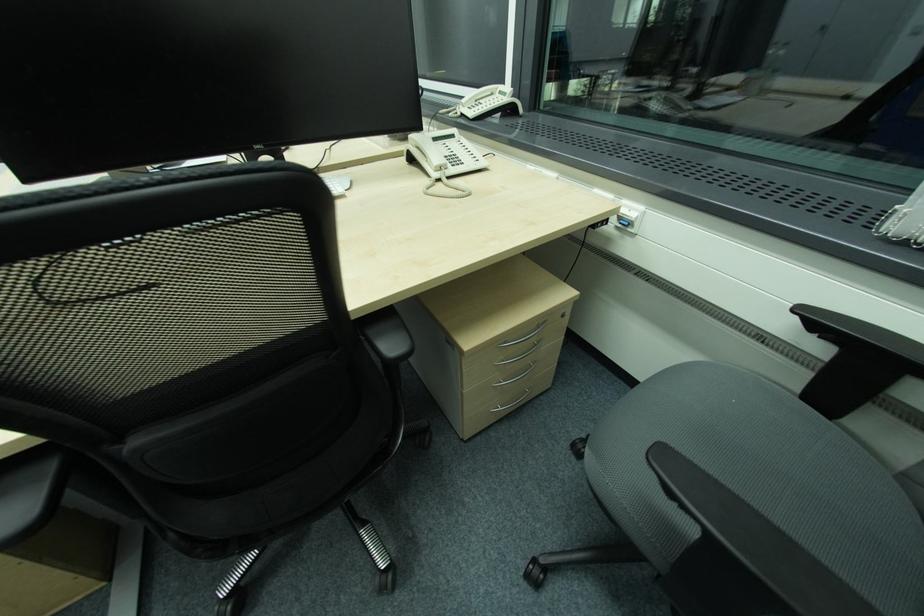
At what (x,y) coordinates should I click in order to perform the action: click on blue rocker switch. Please return your answer as a coordinate pair (x, y). The width and height of the screenshot is (924, 616). Looking at the image, I should click on (627, 220).